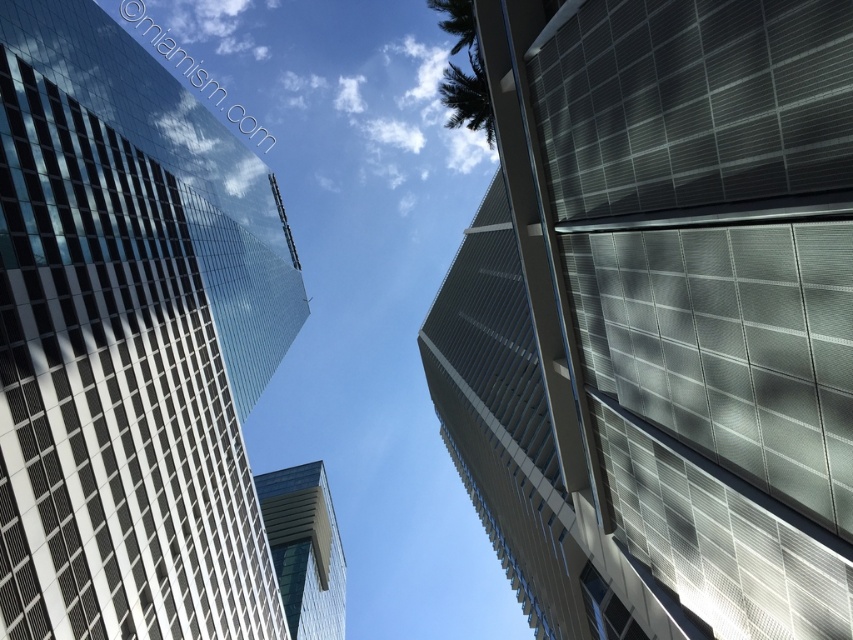
Does point (511, 104) lie behind point (143, 483)?

No, it is in front of (143, 483).

Which is more to the left, sleek metallic building at upper right or transparent glass skyscraper at upper left?

transparent glass skyscraper at upper left

Is point (759, 406) farther from camera compared to point (142, 100)?

No.

Identify the location of sleek metallic building at upper right. The image size is (853, 640). (660, 317).

In the scene shown: Does sleek metallic building at upper right have a lesser width compared to glassy blue skyscraper at center?

Indeed, sleek metallic building at upper right has a lesser width compared to glassy blue skyscraper at center.

Does sleek metallic building at upper right have a greater height compared to glassy blue skyscraper at center?

Yes.

This screenshot has width=853, height=640. Describe the element at coordinates (660, 317) in the screenshot. I see `sleek metallic building at upper right` at that location.

Image resolution: width=853 pixels, height=640 pixels. I want to click on sleek metallic building at upper right, so click(x=660, y=317).

Which is more to the left, transparent glass skyscraper at upper left or glassy blue skyscraper at center?

Positioned to the left is transparent glass skyscraper at upper left.

Does transparent glass skyscraper at upper left have a lesser width compared to glassy blue skyscraper at center?

Incorrect, transparent glass skyscraper at upper left's width is not less than glassy blue skyscraper at center's.

In order to click on transparent glass skyscraper at upper left in this screenshot , I will do `click(129, 342)`.

Find the location of a particular element. Image resolution: width=853 pixels, height=640 pixels. transparent glass skyscraper at upper left is located at coordinates tap(129, 342).